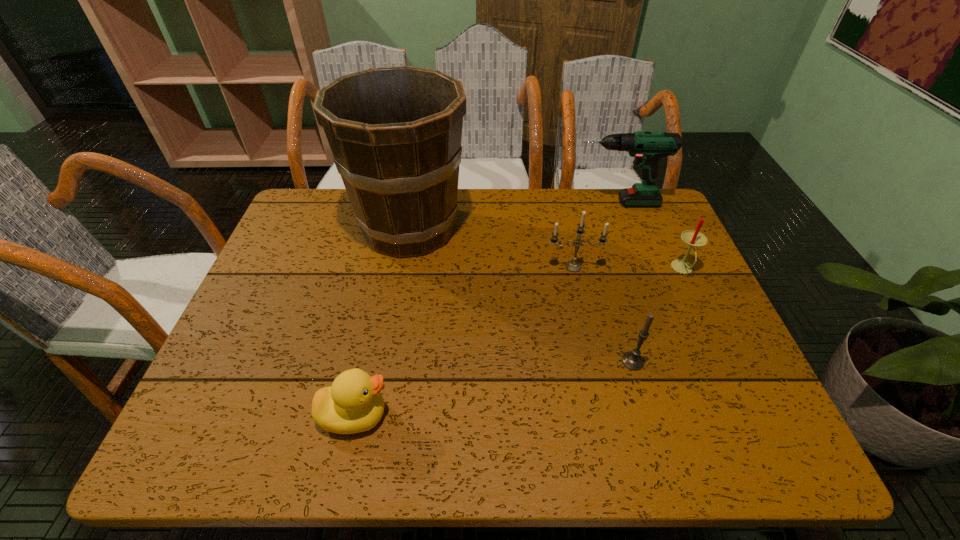
This screenshot has width=960, height=540. I want to click on vacant space that's between the rightmost candle and the nearest candle, so click(x=658, y=315).

Where is `vacant area between the second nearest object and the duck`? vacant area between the second nearest object and the duck is located at coordinates (493, 388).

Locate an element on the screen. vacant space that's between the nearest object and the rightmost candle is located at coordinates (518, 342).

I want to click on object that ranks as the fifth closest to the drill, so pos(353,404).

Select which object appears as the third closest to the fifth shortest object. Please provide its 2D coordinates. Your answer should be formatted as a tuple, i.e. [(x, y)], where the tuple contains the x and y coordinates of a point satisfying the conditions above.

[(395, 133)]

Locate which candle ranks second in proximity to the rightmost candle. Please provide its 2D coordinates. Your answer should be formatted as a tuple, i.e. [(x, y)], where the tuple contains the x and y coordinates of a point satisfying the conditions above.

[(632, 360)]

Locate which candle ranks in proximity to the rightmost candle. Please provide its 2D coordinates. Your answer should be formatted as a tuple, i.e. [(x, y)], where the tuple contains the x and y coordinates of a point satisfying the conditions above.

[(573, 265)]

Where is `free location that satisfies the following two spatial constraints: 1. on the front side of the nearest candle; 2. at the beak of the nearest object`? free location that satisfies the following two spatial constraints: 1. on the front side of the nearest candle; 2. at the beak of the nearest object is located at coordinates (649, 415).